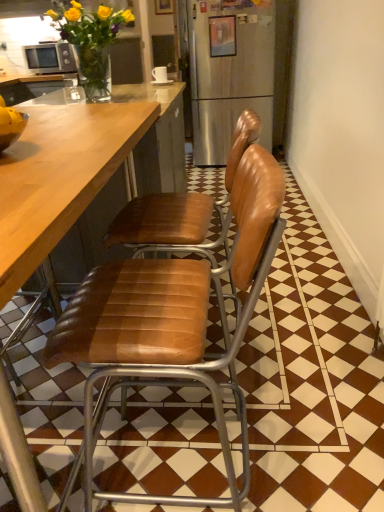
Identify the location of vacant area situated below leather at center, the second chair positioned from the back (from a real-world perspective). (188, 461).